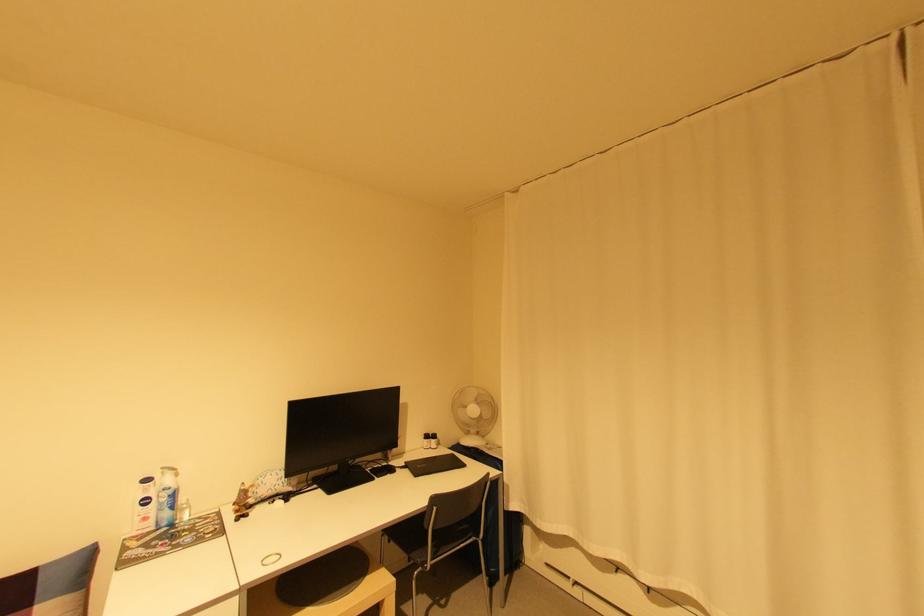
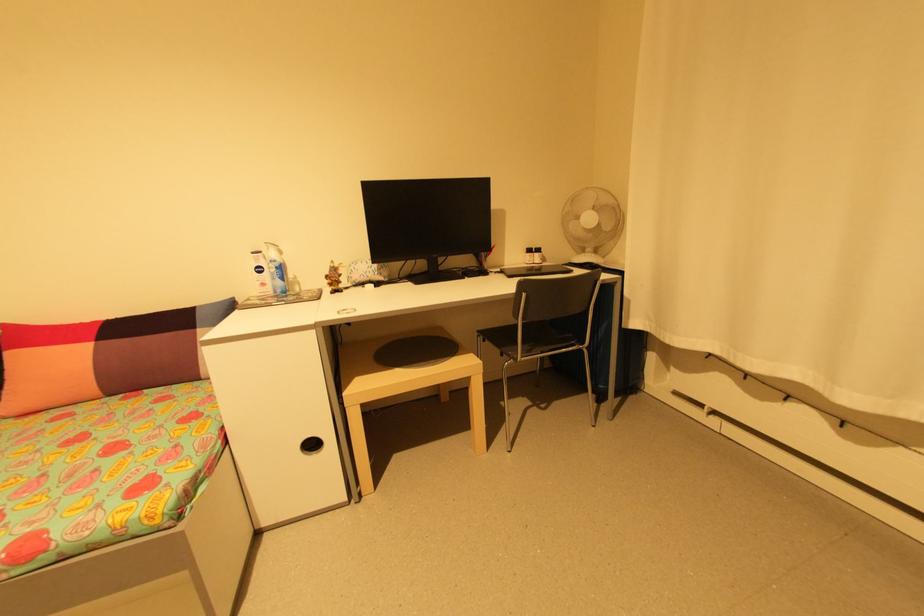
The point at (323, 490) is marked in the first image. Where is the corresponding point in the second image?

(414, 283)